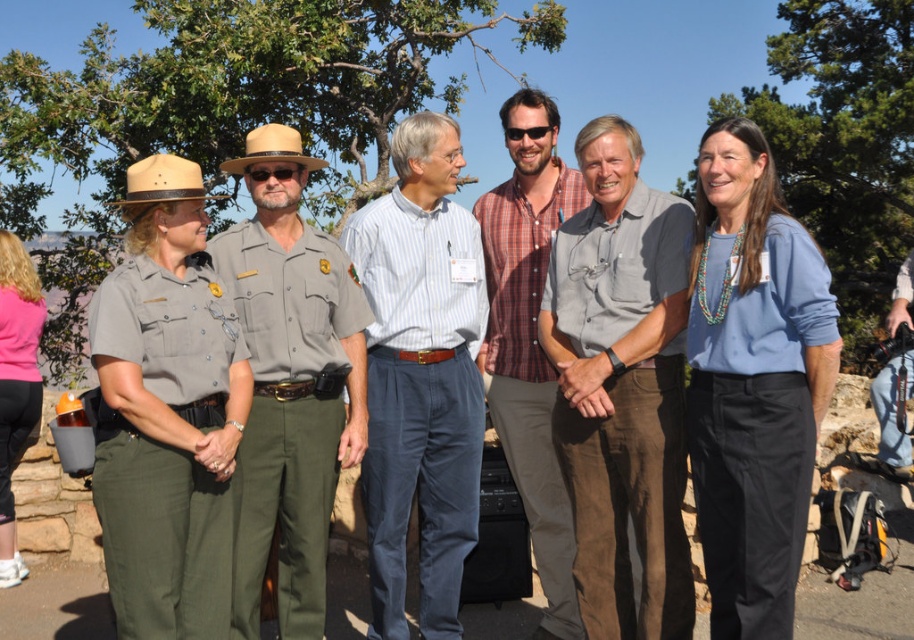
You are organizing a group photo and need to arrange the matte khaki uniform at left and the blue cotton shirt at center based on their widths. Which one should you place on the side that requires a wider space?

The matte khaki uniform at left should be placed on the side that requires a wider space because its width surpasses that of the blue cotton shirt at center.

You are standing at the overlook and want to take a photo of the point at coordinate [688,572]. Your camera has a maximum focus range of 3.5 meters. Will the point be in focus?

The point at coordinate [688,572] is 3.61 meters away from the viewer, which exceeds the camera maximum focus range of 3.5 meters. Therefore, the point will not be in focus.

From the picture: You are a photographer trying to capture a group photo of the gray cotton shirt at center and the matte khaki uniform at left. If you want to ensure both subjects are fully visible in the frame, which subject should you position closer to the camera?

The gray cotton shirt at center should be positioned closer to the camera because it might be wider than the matte khaki uniform at left, ensuring both fit within the frame.